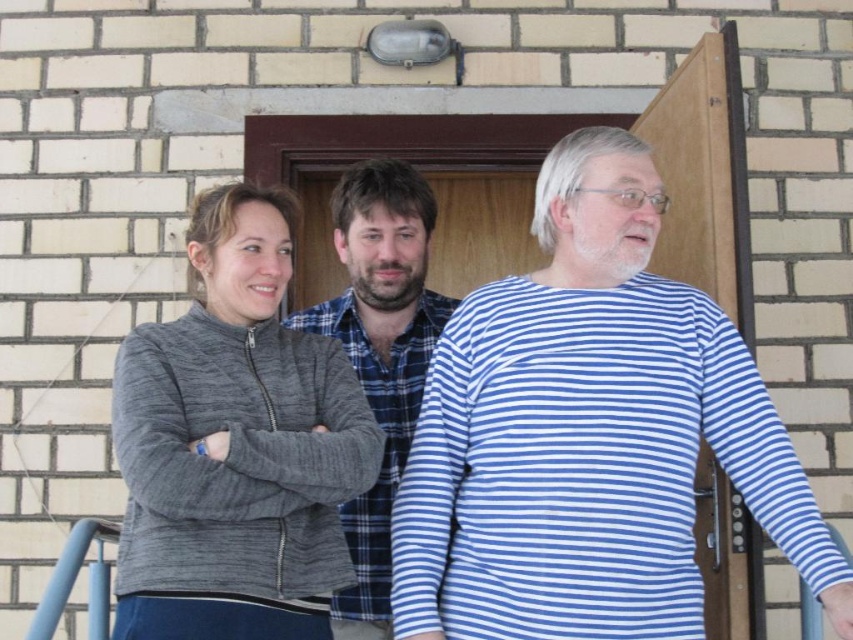
Is blue striped shirt at center to the right of blue plaid shirt at center from the viewer's perspective?

Indeed, blue striped shirt at center is positioned on the right side of blue plaid shirt at center.

How much distance is there between blue striped shirt at center and blue plaid shirt at center?

blue striped shirt at center and blue plaid shirt at center are 18.96 inches apart.

Is point (576, 356) farther from camera compared to point (335, 612)?

No, (576, 356) is in front of (335, 612).

In order to click on blue striped shirt at center in this screenshot , I will do `click(589, 435)`.

Is blue striped shirt at center shorter than gray textured sweater at center?

No, blue striped shirt at center is not shorter than gray textured sweater at center.

Does point (489, 436) come in front of point (155, 484)?

No, (489, 436) is behind (155, 484).

What are the coordinates of `blue striped shirt at center` in the screenshot? It's located at (589, 435).

Is gray textured sweater at center positioned in front of blue plaid shirt at center?

Yes, it is in front of blue plaid shirt at center.

Looking at this image, which of these two, gray textured sweater at center or blue plaid shirt at center, stands taller?

blue plaid shirt at center

This screenshot has width=853, height=640. In order to click on gray textured sweater at center in this screenshot , I will do `click(236, 444)`.